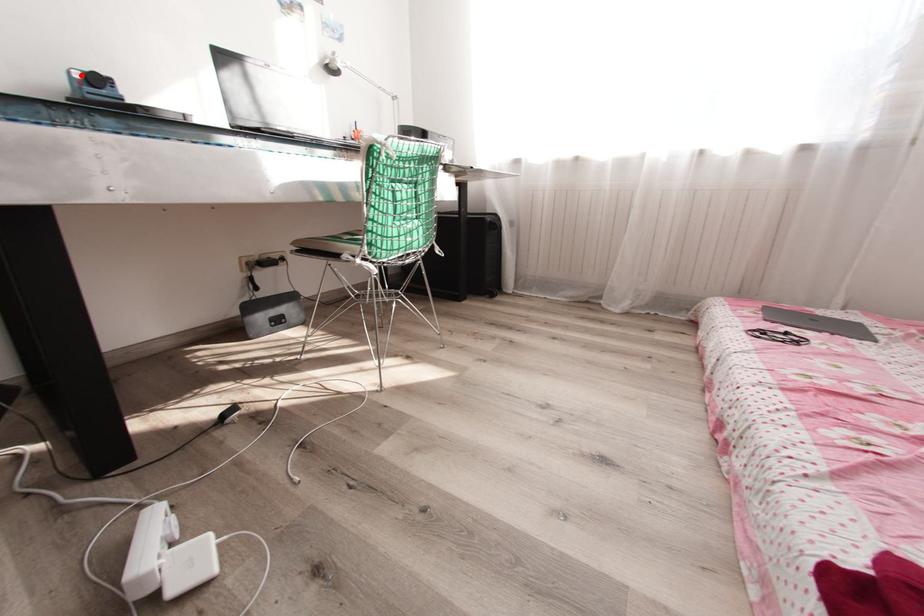
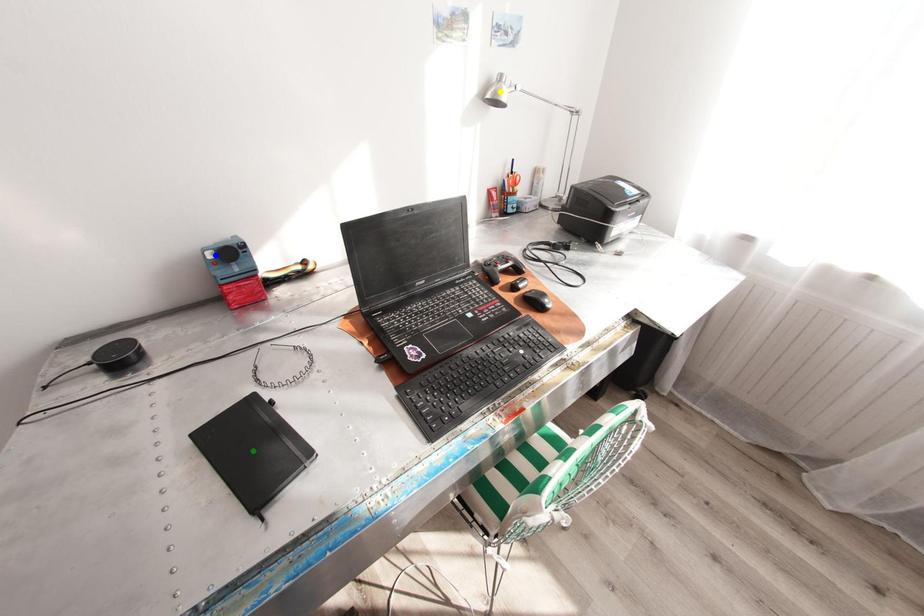
Question: I am providing you with two images of the same scene from different viewpoints. A red point is marked on the first image. You are given multiple points on the second image. In image 2, which mark is for the same physical point as the one in image 1?

Choices:
 (A) green point
 (B) yellow point
 (C) blue point

Answer: (C)